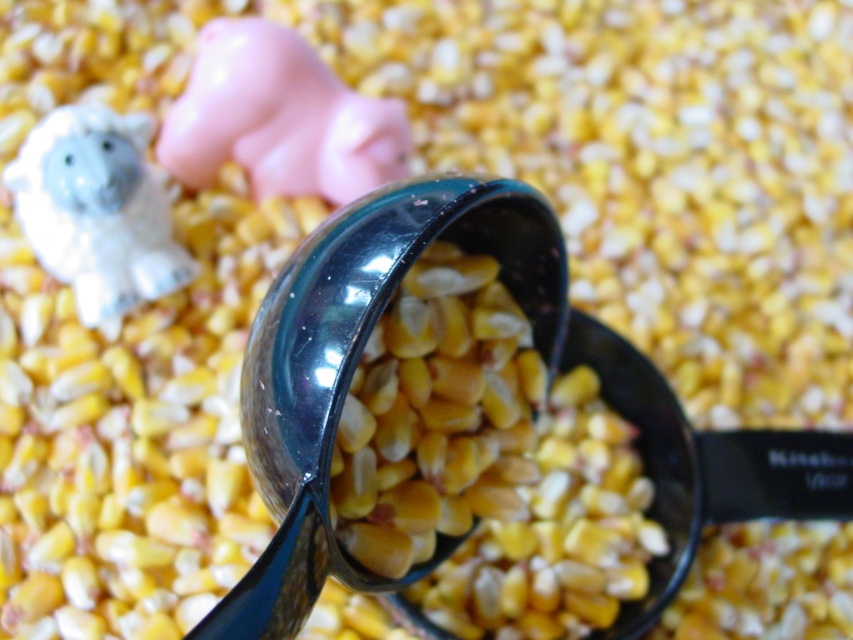
You are setting up a kitchen display and need to place the pink rubber pig at upper center and the white glossy figurine at upper left on a shelf. The shelf has a width of 10 cm. Can both items fit side by side without overlapping?

The pink rubber pig at upper center might be wider than white glossy figurine at upper left, so it is uncertain if both can fit side by side on a 10 cm shelf. Measure their combined width to confirm.

You are setting up a display for a farm theme party and have the pink rubber pig at upper center and the white glossy figurine at upper left. Which figurine should you place higher to make them look balanced?

The pink rubber pig at upper center is shorter than the white glossy figurine at upper left, so you should place the pink rubber pig at upper center higher to balance their heights.

You are a child trying to reach for either the pink rubber pig at upper center or the white glossy figurine at upper left. Which one can you grab first without moving your hand?

The pink rubber pig at upper center is closer to you than the white glossy figurine at upper left, so you can grab it first without moving your hand.